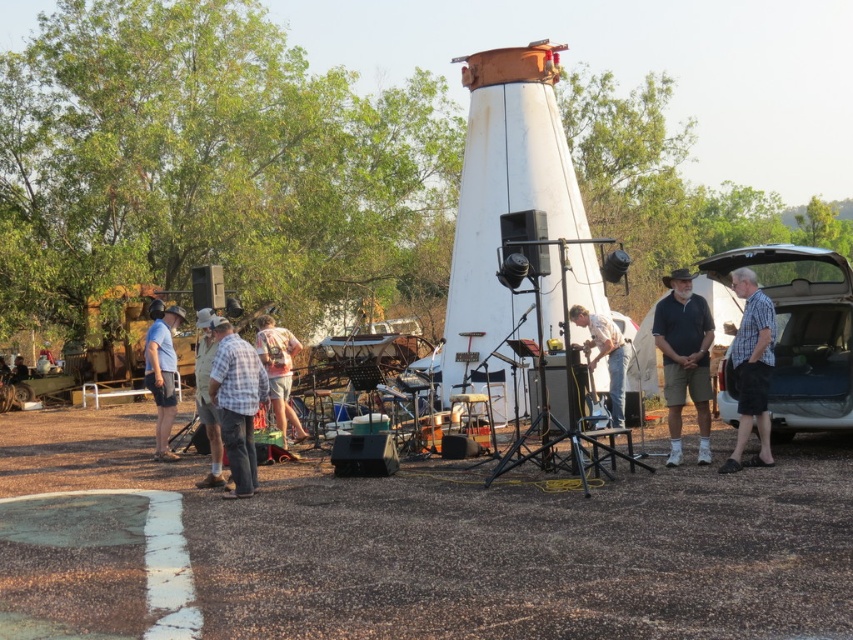
Question: Considering the relative positions of checkered fabric shirt at right and light blue plaid shirt at center left in the image provided, where is checkered fabric shirt at right located with respect to light blue plaid shirt at center left?

Choices:
 (A) left
 (B) right

Answer: (B)

Question: Is white matte car trunk at right positioned before floral shirt at center?

Choices:
 (A) yes
 (B) no

Answer: (A)

Question: Which point is closer to the camera?

Choices:
 (A) plaid shirt at center
 (B) matte black shirt at center
 (C) floral shirt at center

Answer: (A)

Question: Is checkered fabric shirt at right positioned at the back of light blue plaid shirt at center left?

Choices:
 (A) yes
 (B) no

Answer: (B)

Question: Among these points, which one is farthest from the camera?

Choices:
 (A) (833, 284)
 (B) (171, 397)

Answer: (B)

Question: Which of the following is the farthest from the observer?

Choices:
 (A) (200, 353)
 (B) (219, 420)

Answer: (A)